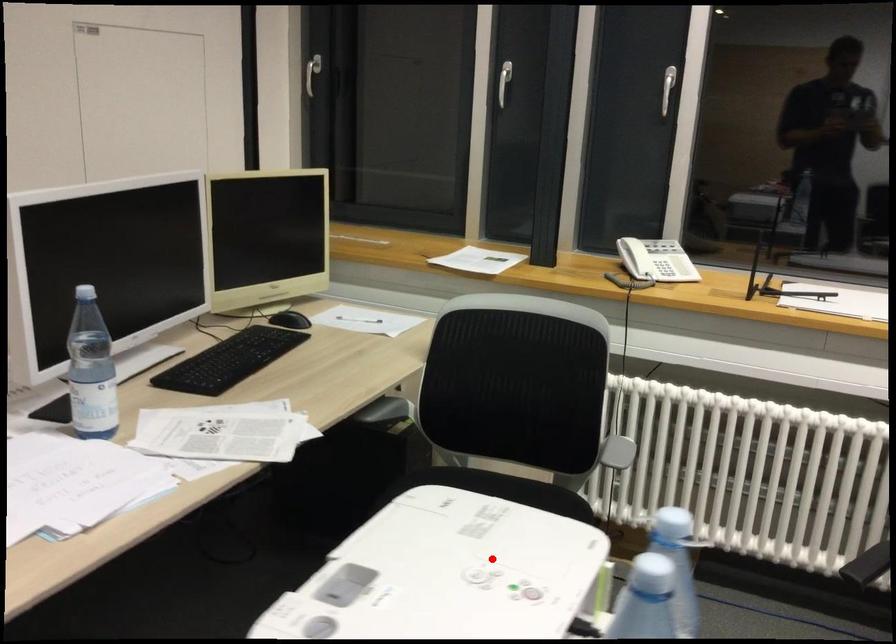
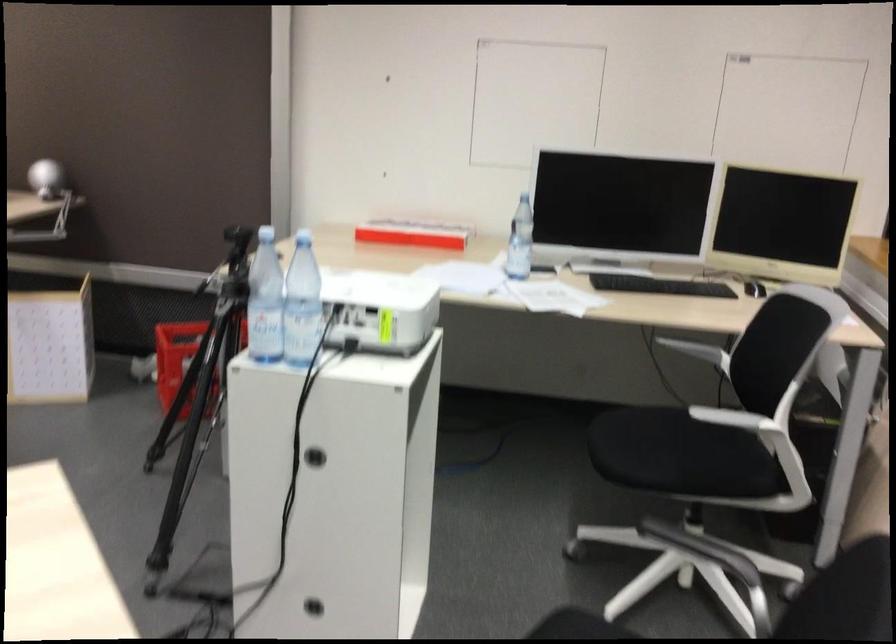
Question: I am providing you with two images of the same scene from different viewpoints. A red point is marked on the first image. Can you still see the location of the red point in image 2?

Choices:
 (A) Yes
 (B) No

Answer: (A)